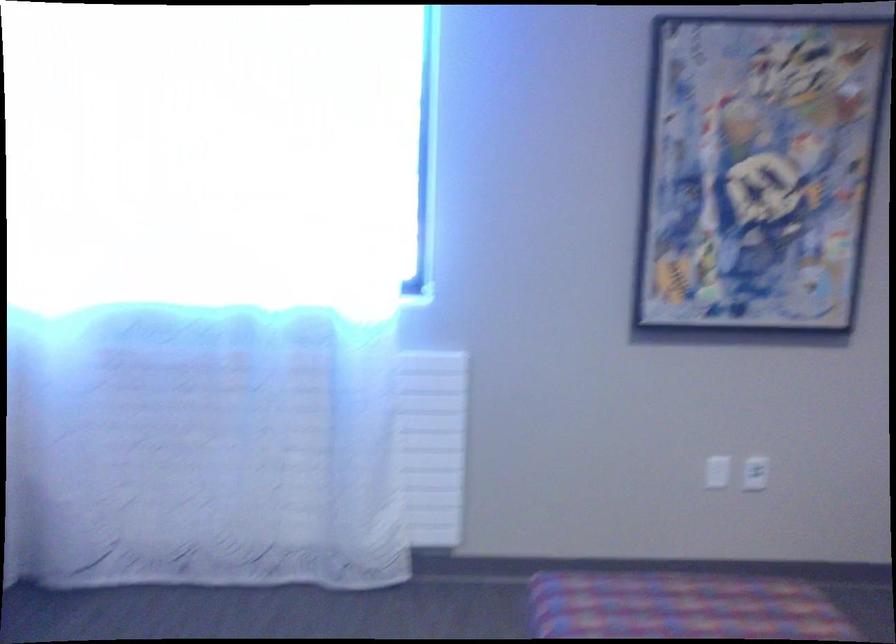
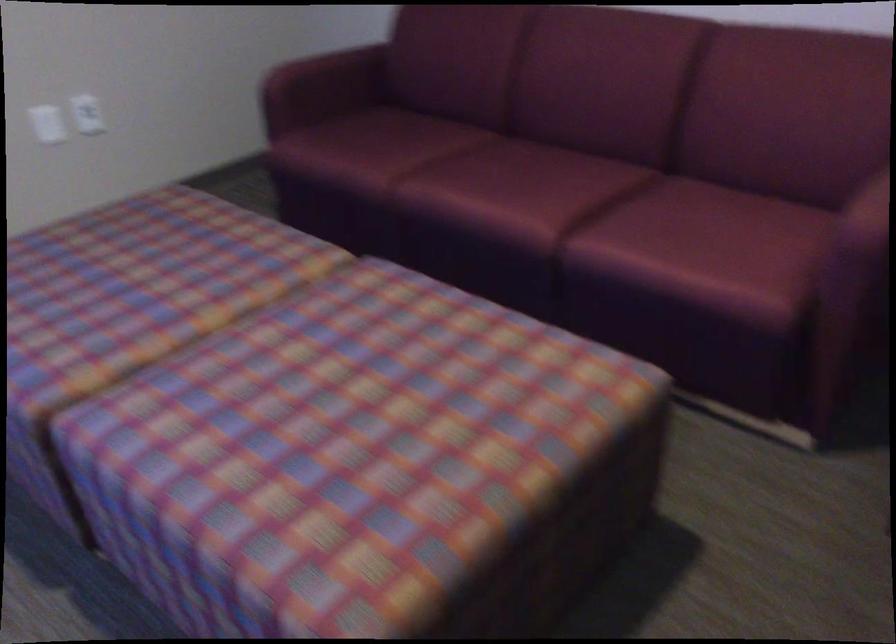
From the picture: First-person continuous shooting, in which direction is the camera rotating?

The camera's rotation is toward right-down.